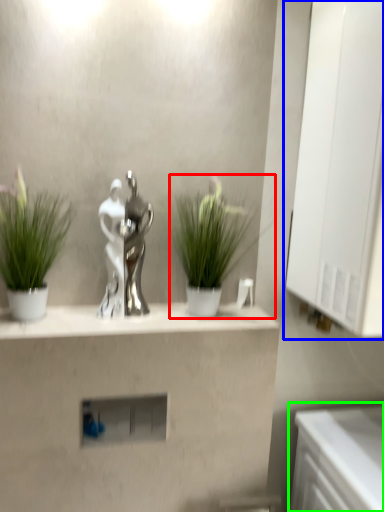
Question: Based on their relative distances, which object is nearer to houseplant (highlighted by a red box)? Choose from medicine cabinet (highlighted by a blue box) and counter (highlighted by a green box).

Choices:
 (A) medicine cabinet
 (B) counter

Answer: (A)